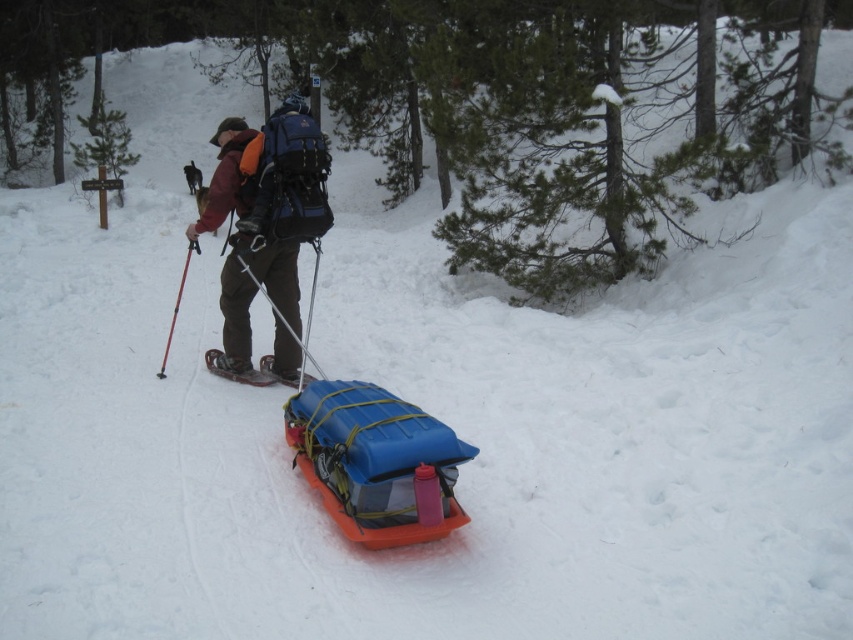
Does matte black backpack at center appear on the left side of metallic snowshoe at center?

No, matte black backpack at center is not to the left of metallic snowshoe at center.

Consider the image. Does matte black backpack at center appear on the right side of metallic snowshoe at center?

Yes, matte black backpack at center is to the right of metallic snowshoe at center.

Who is more distant from viewer, (289,349) or (256,369)?

The point (256,369) is behind.

I want to click on matte black backpack at center, so click(x=248, y=310).